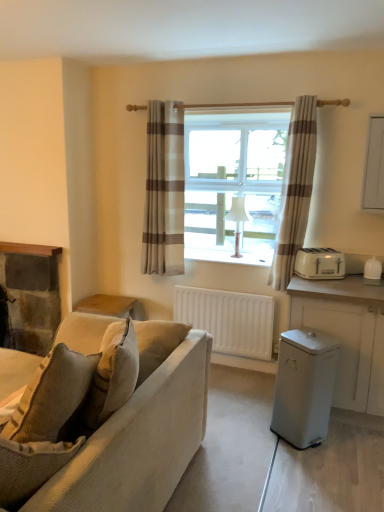
What do you see at coordinates (32, 294) in the screenshot? The image size is (384, 512). I see `dark stone fireplace at left` at bounding box center [32, 294].

This screenshot has width=384, height=512. I want to click on white fabric lampshade at window, so click(237, 220).

Identify the location of beige striped curtain at center, marked as the first curtain in a right-to-left arrangement. Image resolution: width=384 pixels, height=512 pixels. (295, 190).

What do you see at coordinates (164, 191) in the screenshot? I see `beige striped curtain at center, arranged as the first curtain when viewed from the left` at bounding box center [164, 191].

In order to click on white matte cabinet at right in this screenshot , I will do `click(347, 334)`.

In order to face white matte radiator at center, should I rotate leftwards or rightwards?

You should look right and rotate roughly 4.070 degrees.

Where is `dark stone fireplace at left`? The width and height of the screenshot is (384, 512). dark stone fireplace at left is located at coordinates (32, 294).

Is beige striped curtain at center, the second curtain when ordered from left to right, behind beige striped curtain at center, the second curtain positioned from the right?

No, beige striped curtain at center, the second curtain when ordered from left to right, is in front of beige striped curtain at center, the second curtain positioned from the right.

From a real-world perspective, relative to beige striped curtain at center, the second curtain positioned from the right, is beige striped curtain at center, marked as the first curtain in a right-to-left arrangement, vertically above or below?

In terms of real-world spatial position, beige striped curtain at center, marked as the first curtain in a right-to-left arrangement, is below beige striped curtain at center, the second curtain positioned from the right.

Is beige striped curtain at center, the second curtain when ordered from left to right, not near beige striped curtain at center, arranged as the first curtain when viewed from the left?

No, beige striped curtain at center, the second curtain when ordered from left to right, is not far from beige striped curtain at center, arranged as the first curtain when viewed from the left.

Does beige striped curtain at center, marked as the first curtain in a right-to-left arrangement, have a lesser width compared to beige striped curtain at center, the second curtain positioned from the right?

Incorrect, the width of beige striped curtain at center, marked as the first curtain in a right-to-left arrangement, is not less than that of beige striped curtain at center, the second curtain positioned from the right.

From a real-world perspective, is white matte cabinet at right below white fabric lampshade at window?

Correct, in the physical world, white matte cabinet at right is lower than white fabric lampshade at window.

Are white matte cabinet at right and white fabric lampshade at window making contact?

white matte cabinet at right is not next to white fabric lampshade at window, and they're not touching.

From the image's perspective, is white matte cabinet at right under white fabric lampshade at window?

Yes, from the image's perspective, white matte cabinet at right is beneath white fabric lampshade at window.

Is white matte cabinet at right located outside white fabric lampshade at window?

Indeed, white matte cabinet at right is completely outside white fabric lampshade at window.

Is beige striped curtain at center, the second curtain when ordered from left to right, aimed at white plastic toaster at right, placed as the 2th appliance when sorted from bottom to top?

No, beige striped curtain at center, the second curtain when ordered from left to right, is not aimed at white plastic toaster at right, placed as the 2th appliance when sorted from bottom to top.

Which object is more forward, beige striped curtain at center, the second curtain when ordered from left to right, or white plastic toaster at right, placed as the 2th appliance when sorted from bottom to top?

Positioned in front is beige striped curtain at center, the second curtain when ordered from left to right.

Is beige striped curtain at center, marked as the first curtain in a right-to-left arrangement, to the left of white plastic toaster at right, which appears as the 2th appliance when viewed from the front, from the viewer's perspective?

Correct, you'll find beige striped curtain at center, marked as the first curtain in a right-to-left arrangement, to the left of white plastic toaster at right, which appears as the 2th appliance when viewed from the front.

From a real-world perspective, between beige striped curtain at center, marked as the first curtain in a right-to-left arrangement, and white plastic toaster at right, which appears as the 2th appliance when viewed from the front, who is vertically lower?

From a 3D spatial view, white plastic toaster at right, which appears as the 2th appliance when viewed from the front, is below.

From a real-world perspective, is white fabric lampshade at window physically located above or below beige striped curtain at center, the second curtain when ordered from left to right?

white fabric lampshade at window is situated lower than beige striped curtain at center, the second curtain when ordered from left to right, in the real world.

Does white fabric lampshade at window lie behind beige striped curtain at center, marked as the first curtain in a right-to-left arrangement?

That is True.

Which of these two, white fabric lampshade at window or beige striped curtain at center, the second curtain when ordered from left to right, is thinner?

white fabric lampshade at window.

From their relative heights in the image, would you say white fabric lampshade at window is taller or shorter than beige striped curtain at center, the second curtain when ordered from left to right?

In the image, white fabric lampshade at window appears to be shorter than beige striped curtain at center, the second curtain when ordered from left to right.

In the scene shown: Who is shorter, beige striped curtain at center, arranged as the first curtain when viewed from the left, or white plastic trash can at lower right, which ranks as the second appliance in top-to-bottom order?

white plastic trash can at lower right, which ranks as the second appliance in top-to-bottom order.

Is beige striped curtain at center, arranged as the first curtain when viewed from the left, not near white plastic trash can at lower right, which ranks as the second appliance in top-to-bottom order?

beige striped curtain at center, arranged as the first curtain when viewed from the left, is far away from white plastic trash can at lower right, which ranks as the second appliance in top-to-bottom order.

Measure the distance from beige striped curtain at center, arranged as the first curtain when viewed from the left, to white plastic trash can at lower right, acting as the 2th appliance starting from the back.

They are 1.47 meters apart.

Is white plastic trash can at lower right, arranged as the first appliance when ordered from the bottom, facing away from beige striped curtain at center, marked as the first curtain in a right-to-left arrangement?

No, beige striped curtain at center, marked as the first curtain in a right-to-left arrangement, is not at the back of white plastic trash can at lower right, arranged as the first appliance when ordered from the bottom.

In the scene shown: How different are the orientations of white plastic trash can at lower right, arranged as the first appliance when ordered from the bottom, and beige striped curtain at center, the second curtain when ordered from left to right, in degrees?

31.4 degrees separate the facing orientations of white plastic trash can at lower right, arranged as the first appliance when ordered from the bottom, and beige striped curtain at center, the second curtain when ordered from left to right.

Considering the positions of objects white plastic trash can at lower right, arranged as the 1th appliance when viewed from the front, and beige striped curtain at center, marked as the first curtain in a right-to-left arrangement, in the image provided, who is behind, white plastic trash can at lower right, arranged as the 1th appliance when viewed from the front, or beige striped curtain at center, marked as the first curtain in a right-to-left arrangement,?

beige striped curtain at center, marked as the first curtain in a right-to-left arrangement, is further from the camera.

Identify the location of appliance on the left of the beige striped curtain at center, marked as the first curtain in a right-to-left arrangement. (304, 386).

Identify the location of lamp on the right side of dark stone fireplace at left. This screenshot has width=384, height=512. (237, 220).

Is white fabric lampshade at window wider than dark stone fireplace at left?

Yes, white fabric lampshade at window is wider than dark stone fireplace at left.

Does white fabric lampshade at window have a smaller size compared to dark stone fireplace at left?

Yes.

Where is `curtain located above the beige striped curtain at center, the second curtain when ordered from left to right (from the image's perspective)`? The image size is (384, 512). curtain located above the beige striped curtain at center, the second curtain when ordered from left to right (from the image's perspective) is located at coordinates (164, 191).

Locate an element on the screen. lamp on the left of white matte cabinet at right is located at coordinates (237, 220).

Which object lies nearer to the anchor point white plastic trash can at lower right, which ranks as the second appliance in top-to-bottom order, white matte cabinet at right or beige striped curtain at center, the second curtain when ordered from left to right?

white matte cabinet at right.

Looking at this image, when comparing their distances from beige striped curtain at center, arranged as the first curtain when viewed from the left, does white plastic trash can at lower right, arranged as the 1th appliance when viewed from the front, or white matte cabinet at right seem closer?

Based on the image, white matte cabinet at right appears to be nearer to beige striped curtain at center, arranged as the first curtain when viewed from the left.

Estimate the real-world distances between objects in this image. Which object is closer to dark stone fireplace at left, white fabric lampshade at window or white matte cabinet at right?

The object closer to dark stone fireplace at left is white fabric lampshade at window.

From the image, which object appears to be nearer to dark stone fireplace at left, textured beige couch at left or beige striped curtain at center, the second curtain when ordered from left to right?

textured beige couch at left is positioned closer to the anchor dark stone fireplace at left.

Looking at the image, which one is located closer to beige striped curtain at center, arranged as the first curtain when viewed from the left, beige striped curtain at center, the second curtain when ordered from left to right, or white matte cabinet at right?

Among the two, beige striped curtain at center, the second curtain when ordered from left to right, is located nearer to beige striped curtain at center, arranged as the first curtain when viewed from the left.

Based on their spatial positions, is beige striped curtain at center, arranged as the first curtain when viewed from the left, or white fabric lampshade at window closer to white plastic toaster at right, the first appliance when ordered from back to front?

white fabric lampshade at window is positioned closer to the anchor white plastic toaster at right, the first appliance when ordered from back to front.

Considering their positions, is white plastic toaster at right, the first appliance when ordered from back to front, positioned further to white fabric lampshade at window than white matte cabinet at right?

white matte cabinet at right.

Based on their spatial positions, is white plastic toaster at right, positioned as the 1th appliance in top-to-bottom order, or beige striped curtain at center, the second curtain when ordered from left to right, further from textured beige couch at left?

beige striped curtain at center, the second curtain when ordered from left to right, is further to textured beige couch at left.

The width and height of the screenshot is (384, 512). I want to click on cabinetry between white plastic trash can at lower right, arranged as the first appliance when ordered from the bottom, and white fabric lampshade at window from front to back, so click(347, 334).

At what (x,y) coordinates should I click in order to perform the action: click on lamp that lies between beige striped curtain at center, arranged as the first curtain when viewed from the left, and white plastic trash can at lower right, acting as the 2th appliance starting from the back, from top to bottom. Please return your answer as a coordinate pair (x, y). Looking at the image, I should click on point(237,220).

At what (x,y) coordinates should I click in order to perform the action: click on cabinetry between textured beige couch at left and white matte radiator at center along the z-axis. Please return your answer as a coordinate pair (x, y). The width and height of the screenshot is (384, 512). Looking at the image, I should click on (347, 334).

Image resolution: width=384 pixels, height=512 pixels. I want to click on cabinetry between white plastic toaster at right, positioned as the 1th appliance in top-to-bottom order, and white plastic trash can at lower right, which ranks as the second appliance in top-to-bottom order, vertically, so click(347, 334).